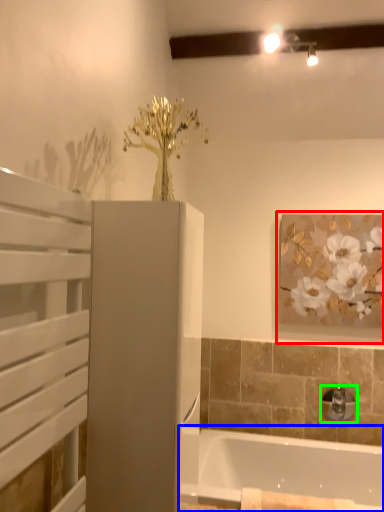
Question: Estimate the real-world distances between objects in this image. Which object is closer to picture frame (highlighted by a red box), bathtub (highlighted by a blue box) or tap (highlighted by a green box)?

Choices:
 (A) bathtub
 (B) tap

Answer: (B)